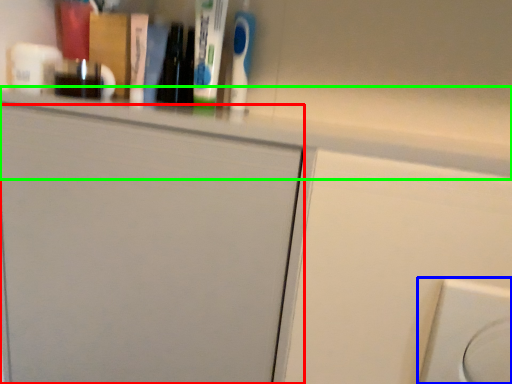
Question: Which object is positioned farthest from door (highlighted by a red box)? Select from electric outlet (highlighted by a blue box) and ledge (highlighted by a green box).

Choices:
 (A) electric outlet
 (B) ledge

Answer: (A)